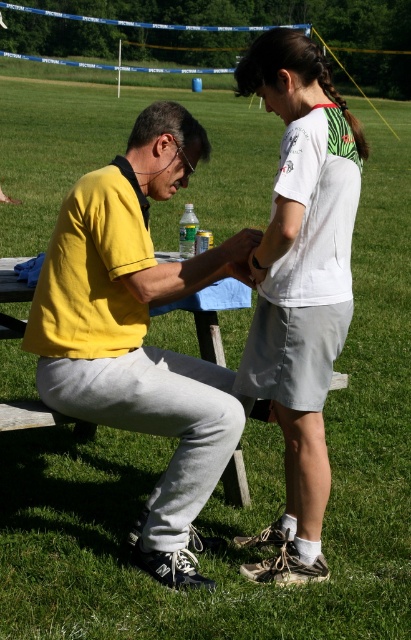
Question: Does yellow matte shirt at center have a smaller size compared to white cotton t-shirt at upper center?

Choices:
 (A) yes
 (B) no

Answer: (B)

Question: Among these points, which one is nearest to the camera?

Choices:
 (A) (307, 65)
 (B) (37, 316)

Answer: (A)

Question: Which point is farther to the camera?

Choices:
 (A) yellow matte shirt at center
 (B) white cotton t-shirt at upper center

Answer: (A)

Question: Which of the following is the closest to the observer?

Choices:
 (A) (171, 385)
 (B) (302, 84)

Answer: (B)

Question: Does yellow matte shirt at center appear on the right side of white cotton t-shirt at upper center?

Choices:
 (A) yes
 (B) no

Answer: (B)

Question: Is yellow matte shirt at center bigger than white cotton t-shirt at upper center?

Choices:
 (A) yes
 (B) no

Answer: (A)